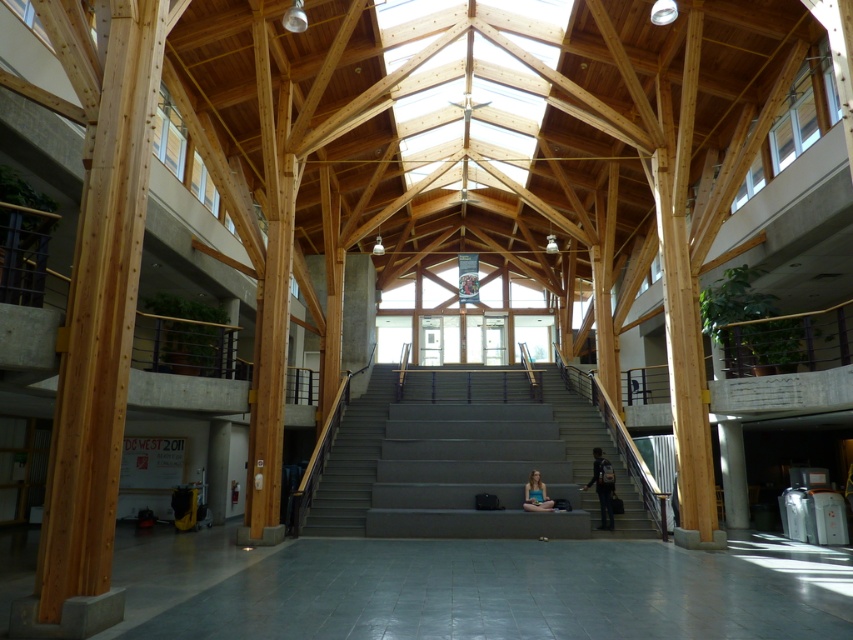
Can you confirm if gray concrete stairs at center is positioned below matte blue shirt at center?

Actually, gray concrete stairs at center is above matte blue shirt at center.

Does gray concrete stairs at center have a lesser height compared to matte blue shirt at center?

No.

Does point (383, 372) lie in front of point (537, 472)?

That is False.

Identify the location of gray concrete stairs at center. (466, 456).

Is gray concrete stairs at center smaller than dark blue backpack at center?

No.

Where is `gray concrete stairs at center`? gray concrete stairs at center is located at coordinates (466, 456).

Where is `gray concrete stairs at center`? The width and height of the screenshot is (853, 640). gray concrete stairs at center is located at coordinates (466, 456).

Looking at this image, is gray tile floor at lower center to the left of gray concrete stairs at center from the viewer's perspective?

In fact, gray tile floor at lower center is to the right of gray concrete stairs at center.

Can you confirm if gray tile floor at lower center is wider than gray concrete stairs at center?

Yes.

Who is more forward, (515, 618) or (376, 531)?

Point (515, 618) is more forward.

Image resolution: width=853 pixels, height=640 pixels. Identify the location of gray tile floor at lower center. (521, 592).